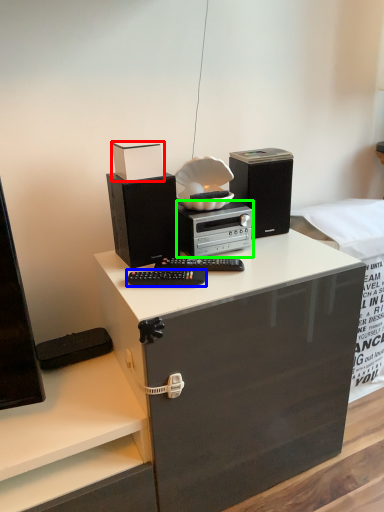
Question: Considering the real-world distances, which object is closest to box (highlighted by a red box)? equipment (highlighted by a blue box) or home appliance (highlighted by a green box).

Choices:
 (A) equipment
 (B) home appliance

Answer: (B)